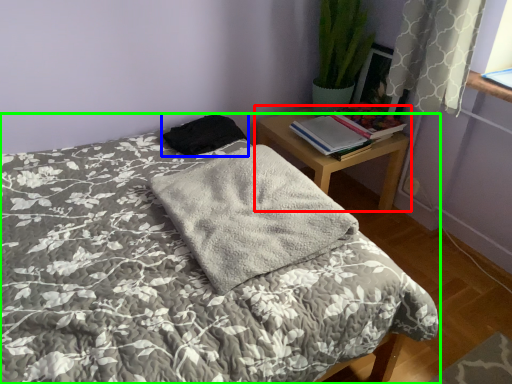
Question: Which object is positioned closest to nightstand (highlighted by a red box)? Select from material (highlighted by a blue box) and bed (highlighted by a green box).

Choices:
 (A) material
 (B) bed

Answer: (A)